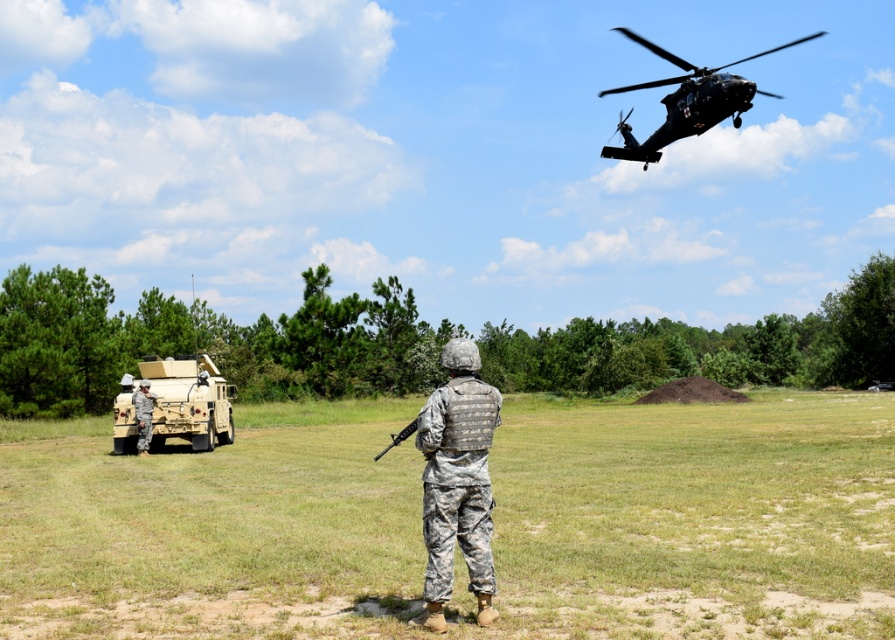
You are a drone operator observing the military training area. You need to determine which object is nearer to your vantage point. Which is closer to you, the camouflage fabric field at center or the camouflage uniform at left?

The camouflage fabric field at center is closer to the viewer than the camouflage uniform at left.

You are a soldier in the scene and need to move to a specific location marked by the point at coordinates (735, 80). The distance between you and the point is 24.89 meters. If your maximum sprinting distance without rest is 25 meters, can you reach the point without stopping?

The point at coordinates (735, 80) is 24.89 meters away from you. Since your maximum sprinting distance without rest is 25 meters, you can reach the point without stopping as the distance is slightly less than your limit.